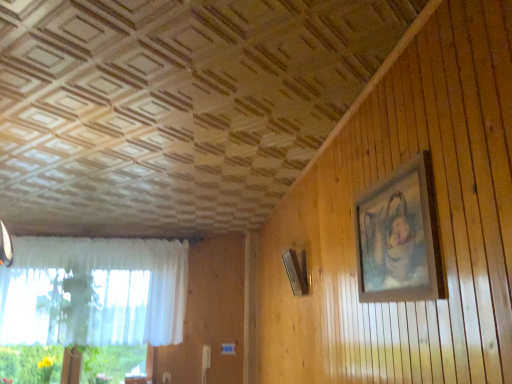
Question: Considering the relative sizes of wooden picture frame at upper right and white sheer curtain at left in the image provided, is wooden picture frame at upper right bigger than white sheer curtain at left?

Choices:
 (A) yes
 (B) no

Answer: (B)

Question: Is wooden picture frame at upper right wider than white sheer curtain at left?

Choices:
 (A) yes
 (B) no

Answer: (B)

Question: Is wooden picture frame at upper right to the right of white sheer curtain at left from the viewer's perspective?

Choices:
 (A) no
 (B) yes

Answer: (B)

Question: Is wooden picture frame at upper right far away from white sheer curtain at left?

Choices:
 (A) yes
 (B) no

Answer: (A)

Question: From a real-world perspective, is wooden picture frame at upper right over white sheer curtain at left?

Choices:
 (A) yes
 (B) no

Answer: (A)

Question: Could you tell me if wooden picture frame at upper right is turned towards white sheer curtain at left?

Choices:
 (A) no
 (B) yes

Answer: (A)

Question: Can you confirm if white sheer curtain at left is thinner than wooden picture frame at upper right?

Choices:
 (A) no
 (B) yes

Answer: (A)

Question: From a real-world perspective, is white sheer curtain at left physically above wooden picture frame at upper right?

Choices:
 (A) no
 (B) yes

Answer: (A)

Question: Is wooden picture frame at upper right at the back of white sheer curtain at left?

Choices:
 (A) no
 (B) yes

Answer: (A)

Question: Is the depth of white sheer curtain at left greater than that of wooden picture frame at upper right?

Choices:
 (A) yes
 (B) no

Answer: (A)

Question: Is white sheer curtain at left oriented towards wooden picture frame at upper right?

Choices:
 (A) yes
 (B) no

Answer: (A)

Question: Is white sheer curtain at left smaller than wooden picture frame at upper right?

Choices:
 (A) no
 (B) yes

Answer: (A)

Question: Relative to white sheer curtain at left, is wooden picture frame at upper right in front or behind?

Choices:
 (A) front
 (B) behind

Answer: (A)